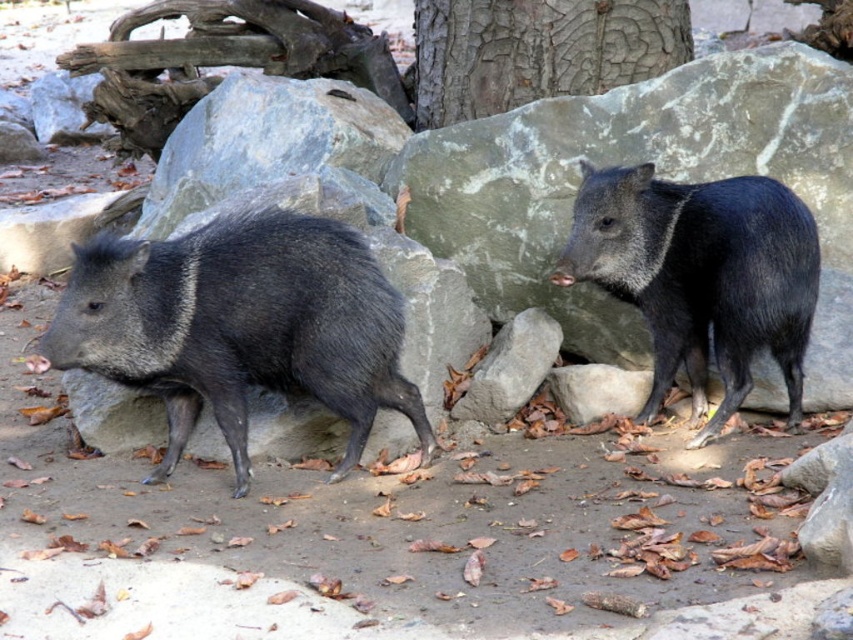
Question: Can you confirm if shiny black boar at left is positioned to the right of cracked bark tree trunk at upper center?

Choices:
 (A) yes
 (B) no

Answer: (B)

Question: Which point is closer to the camera?

Choices:
 (A) (349, 468)
 (B) (671, 236)

Answer: (A)

Question: Which object appears closest to the camera in this image?

Choices:
 (A) shiny black boar at left
 (B) cracked bark tree trunk at upper center
 (C) black glossy pig at upper right

Answer: (A)

Question: Which point is closer to the camera?

Choices:
 (A) (801, 390)
 (B) (585, 49)
 (C) (338, 365)

Answer: (C)

Question: Is shiny black boar at left smaller than black glossy pig at upper right?

Choices:
 (A) yes
 (B) no

Answer: (B)

Question: Is black glossy pig at upper right smaller than cracked bark tree trunk at upper center?

Choices:
 (A) no
 (B) yes

Answer: (A)